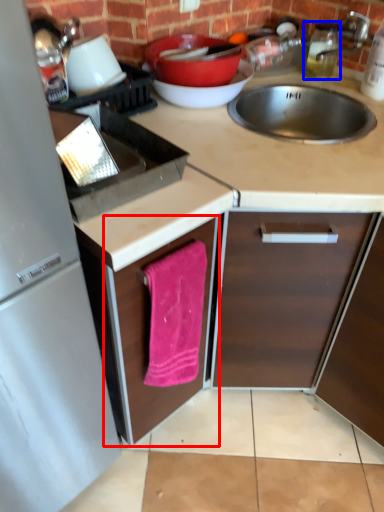
Question: Which object appears farthest to the camera in this image, cabinetry (highlighted by a red box) or bottle (highlighted by a blue box)?

Choices:
 (A) cabinetry
 (B) bottle

Answer: (B)